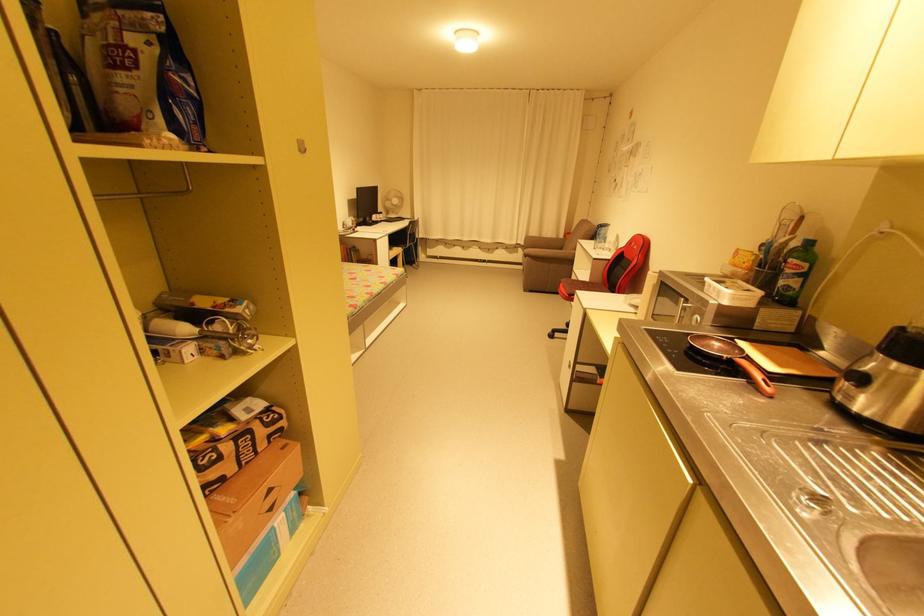
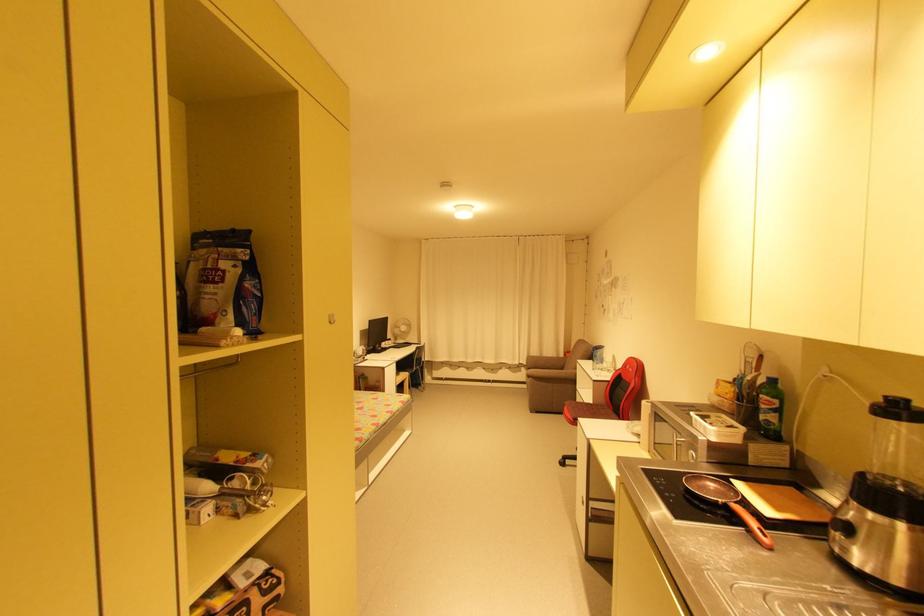
Locate, in the second image, the point that corresponds to (x=385, y=215) in the first image.

(395, 342)